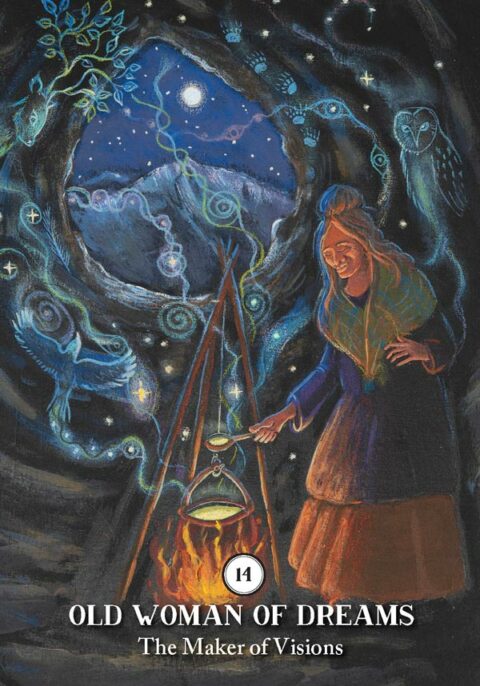
Identify the location of spoon. (232, 440).